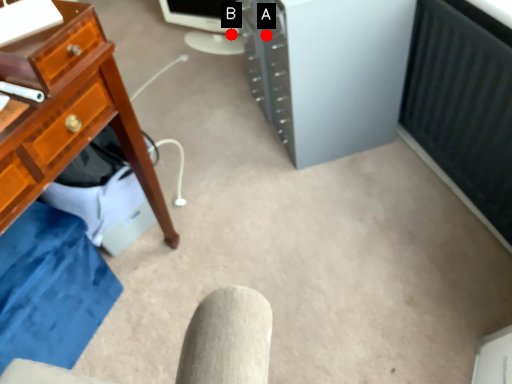
Question: Two points are circled on the image, labeled by A and B beside each circle. Which point is closer to the camera?

Choices:
 (A) A is closer
 (B) B is closer

Answer: (A)